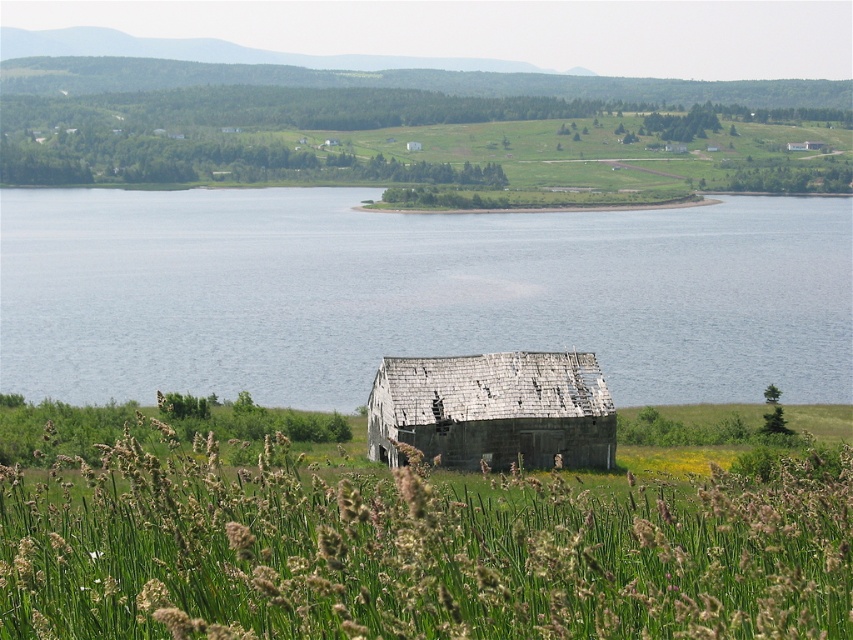
You are standing at the edge of the blue water at center and want to walk to the weathered wood hut at center. Which direction should you go to reach the hut?

Since the blue water at center is wider than the weathered wood hut at center, you should walk towards the direction where the hut is located, which is to the left or right of the water.

You are standing at the edge of the water in the rural landscape scene. You see two points marked on the image. Which point is closer to you, point (x=305, y=573) or point (x=590, y=392)?

Point (x=305, y=573) is in front of point (x=590, y=392), so it is closer to you.